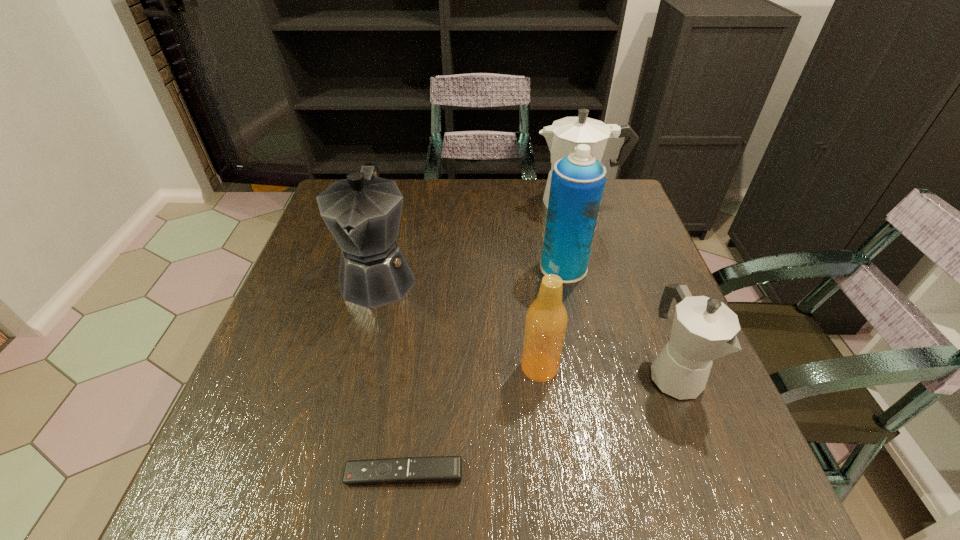
At what (x,y) coordinates should I click in order to perform the action: click on aerosol can. Please return your answer as a coordinate pair (x, y). This screenshot has height=540, width=960. Looking at the image, I should click on (577, 184).

The image size is (960, 540). I want to click on the leftmost coffeepot, so click(363, 212).

Where is `the farthest object`? This screenshot has width=960, height=540. the farthest object is located at coordinates (562, 137).

The width and height of the screenshot is (960, 540). Identify the location of beer bottle. (546, 321).

I want to click on the shortest coffeepot, so click(704, 329).

This screenshot has width=960, height=540. I want to click on the nearest object, so click(x=438, y=469).

This screenshot has width=960, height=540. Identify the location of the shortest object. [438, 469].

Identify the location of free location located 0.110m on the left of the aerosol can. (495, 267).

Find the location of a particular element. vacant area situated at the spout of the leftmost coffeepot is located at coordinates (332, 464).

Image resolution: width=960 pixels, height=540 pixels. I want to click on free space located 0.250m at the spout of the farthest object, so click(x=448, y=203).